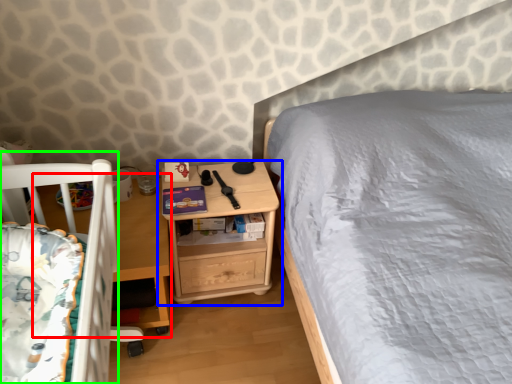
Question: Which object is the farthest from table (highlighted by a red box)? Choose among these: nightstand (highlighted by a blue box) or infant bed (highlighted by a green box).

Choices:
 (A) nightstand
 (B) infant bed

Answer: (B)